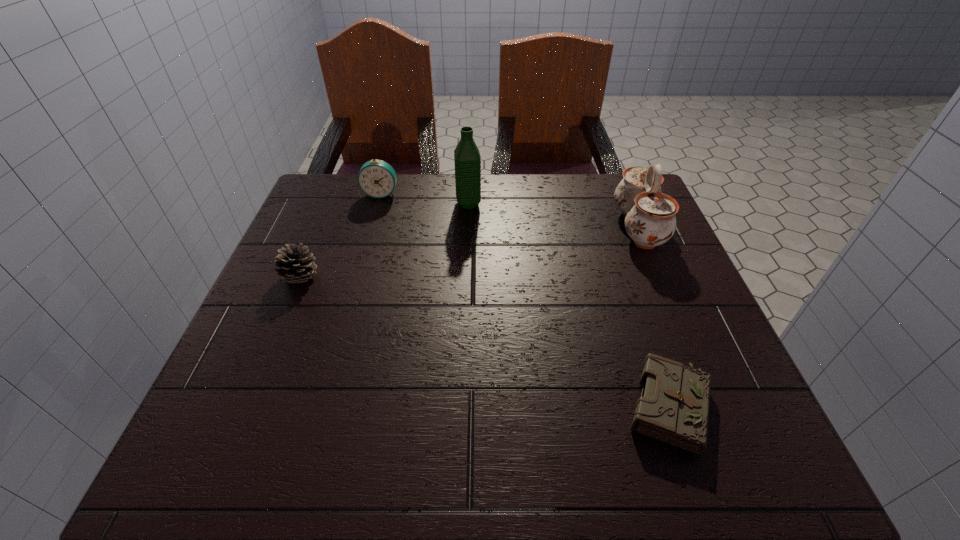
This screenshot has width=960, height=540. I want to click on alarm clock present at the left edge, so (376, 178).

Where is `pinecone that is at the left edge`? pinecone that is at the left edge is located at coordinates (293, 264).

Image resolution: width=960 pixels, height=540 pixels. What are the coordinates of `chinaware located in the right edge section of the desktop` in the screenshot? It's located at (650, 221).

You are a GUI agent. You are given a task and a screenshot of the screen. Output one action in this format:
    pyautogui.click(x=<x>, y=<y>)
    Task: Click on the diary present at the right edge
    The height and width of the screenshot is (540, 960).
    Given the screenshot: What is the action you would take?
    pyautogui.click(x=673, y=408)

Locate an element on the screen. object at the far left corner is located at coordinates (376, 178).

The height and width of the screenshot is (540, 960). I want to click on object at the far right corner, so click(x=650, y=221).

Where is `object at the near right corner`? Image resolution: width=960 pixels, height=540 pixels. object at the near right corner is located at coordinates (673, 408).

Image resolution: width=960 pixels, height=540 pixels. Identify the location of free location at the far edge. (496, 206).

I want to click on vacant space at the near edge of the desktop, so click(553, 472).

The width and height of the screenshot is (960, 540). What are the coordinates of `blank space at the left edge` in the screenshot? It's located at (344, 238).